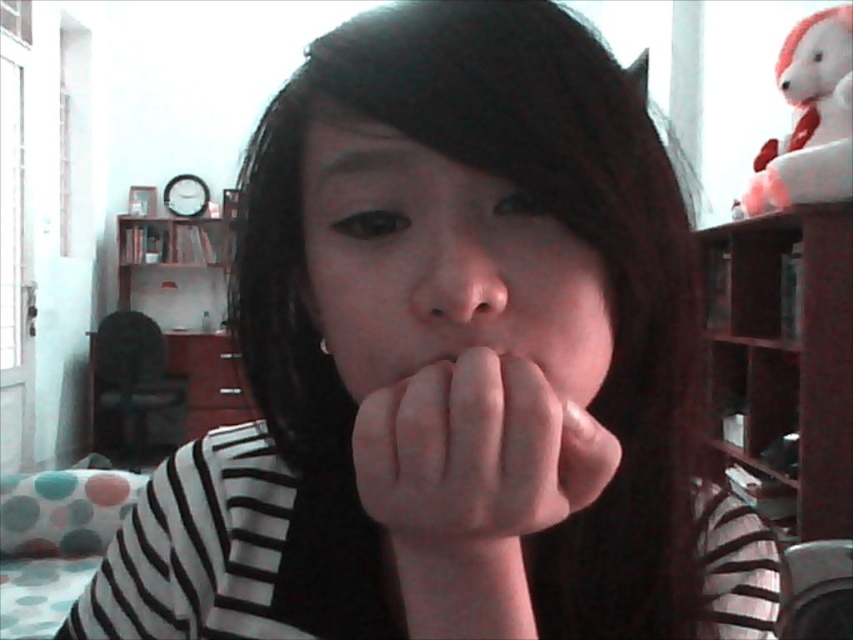
Based on the photo, you are an interior designer assessing the spatial arrangement of this room. Considering the white plush bear at upper right and the pink matte lips at center, which object occupies a larger vertical space in the image?

The white plush bear at upper right is much taller than the pink matte lips at center, so it occupies a larger vertical space in the image.

You are an interior designer planning to place a new painting in the empty space between the white plush bear at upper right and the bookshelf. Based on the coordinates provided, where should the painting be positioned?

The white plush bear at upper right is located at point (808, 118), so the painting should be placed between these coordinates and the bookshelf to ensure proper alignment.

Looking at this image, you are an artist trying to draw the person in the image. You want to ensure the proportions are accurate. Which object is wider when comparing the smooth skin face at center and the smooth skin nose at center?

The smooth skin face at center is wider than the smooth skin nose at center.